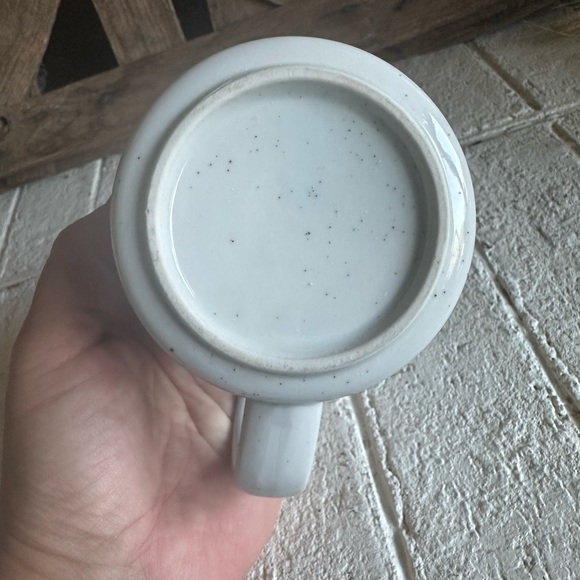
Locate an element on the screen. The height and width of the screenshot is (580, 580). mug handle is located at coordinates (290, 435).